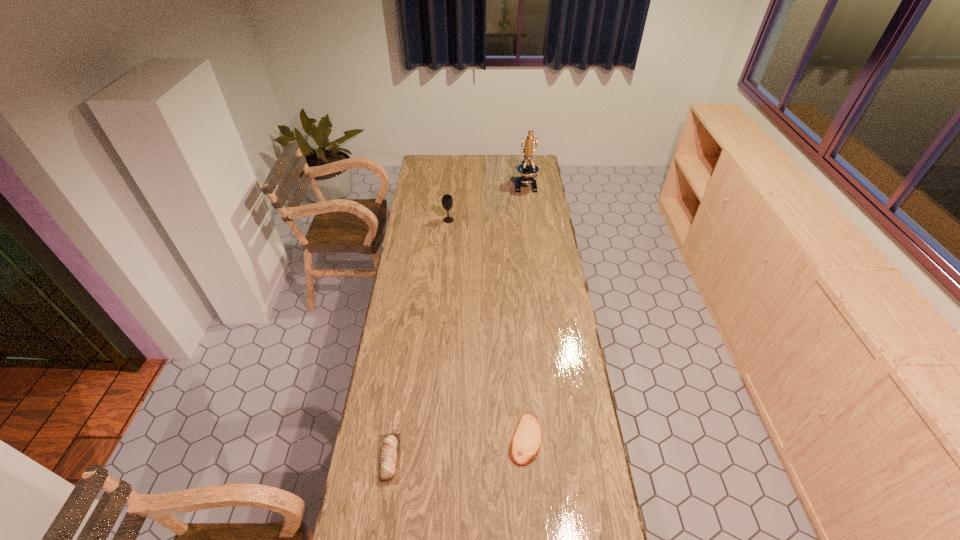
Identify the location of unoccupied position between the left pita bread and the shortest object. The height and width of the screenshot is (540, 960). (458, 449).

Identify the location of blank region between the leftmost object and the shorter pita bread. (458, 449).

Locate an element on the screen. Image resolution: width=960 pixels, height=540 pixels. vacant region between the farthest object and the shortest object is located at coordinates (525, 312).

The height and width of the screenshot is (540, 960). In order to click on free space between the shorter pita bread and the wineglass in this screenshot , I will do `click(487, 329)`.

This screenshot has width=960, height=540. I want to click on vacant point located between the shorter pita bread and the third tallest object, so click(458, 449).

Where is `free area in between the right pita bread and the tallest object`? free area in between the right pita bread and the tallest object is located at coordinates pyautogui.click(x=525, y=312).

Identify the location of vacant space that's between the shortest object and the farthest object. The image size is (960, 540). (525, 312).

Where is `free point between the shortest object and the third nearest object`? free point between the shortest object and the third nearest object is located at coordinates (487, 329).

Find the location of `free space between the microscope and the third nearest object`. free space between the microscope and the third nearest object is located at coordinates (487, 202).

Choose which object is the third nearest neighbor to the taller pita bread. Please provide its 2D coordinates. Your answer should be formatted as a tuple, i.e. [(x, y)], where the tuple contains the x and y coordinates of a point satisfying the conditions above.

[(527, 169)]